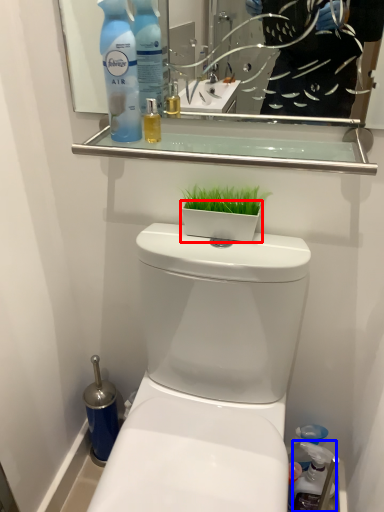
Question: Which point is closer to the camera, flowerpot (highlighted by a red box) or cleaning product (highlighted by a blue box)?

Choices:
 (A) flowerpot
 (B) cleaning product

Answer: (A)